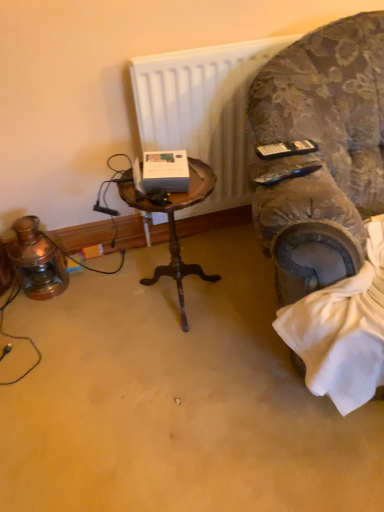
Question: From the image's perspective, is white matte radiator at upper center over velvet-patterned armchair at right?

Choices:
 (A) no
 (B) yes

Answer: (B)

Question: From the image's perspective, is white matte radiator at upper center beneath velvet-patterned armchair at right?

Choices:
 (A) no
 (B) yes

Answer: (A)

Question: Is white matte radiator at upper center at the left side of velvet-patterned armchair at right?

Choices:
 (A) no
 (B) yes

Answer: (B)

Question: Does white matte radiator at upper center lie in front of velvet-patterned armchair at right?

Choices:
 (A) yes
 (B) no

Answer: (B)

Question: Is white matte radiator at upper center outside velvet-patterned armchair at right?

Choices:
 (A) yes
 (B) no

Answer: (A)

Question: In terms of width, does velvet-patterned armchair at right look wider or thinner when compared to white matte radiator at upper center?

Choices:
 (A) thin
 (B) wide

Answer: (B)

Question: From a real-world perspective, is velvet-patterned armchair at right positioned above or below white matte radiator at upper center?

Choices:
 (A) below
 (B) above

Answer: (B)

Question: Does point (347, 209) appear closer or farther from the camera than point (178, 124)?

Choices:
 (A) farther
 (B) closer

Answer: (B)

Question: Is velvet-patterned armchair at right situated inside white matte radiator at upper center or outside?

Choices:
 (A) inside
 (B) outside

Answer: (B)

Question: Considering the positions of woodenobject at center and velvet-patterned armchair at right in the image, is woodenobject at center taller or shorter than velvet-patterned armchair at right?

Choices:
 (A) tall
 (B) short

Answer: (B)

Question: Considering the positions of point (198, 183) and point (291, 108), is point (198, 183) closer or farther from the camera than point (291, 108)?

Choices:
 (A) closer
 (B) farther

Answer: (B)

Question: In terms of size, does woodenobject at center appear bigger or smaller than velvet-patterned armchair at right?

Choices:
 (A) small
 (B) big

Answer: (A)

Question: Is woodenobject at center to the left or to the right of velvet-patterned armchair at right in the image?

Choices:
 (A) right
 (B) left

Answer: (B)

Question: Considering their positions, is velvet-patterned armchair at right located in front of or behind woodenobject at center?

Choices:
 (A) front
 (B) behind

Answer: (A)

Question: Considering the positions of point (311, 34) and point (198, 167), is point (311, 34) closer or farther from the camera than point (198, 167)?

Choices:
 (A) farther
 (B) closer

Answer: (B)